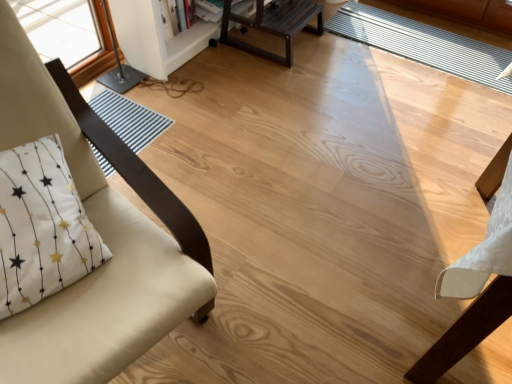
The height and width of the screenshot is (384, 512). I want to click on beige fabric chair at left, so click(104, 240).

Measure the distance between point (195, 288) and camera.

35.75 inches.

Image resolution: width=512 pixels, height=384 pixels. I want to click on white painted wood bookshelf at upper center, so click(156, 37).

Locate an element on the screen. This screenshot has height=384, width=512. white striped mat at center is located at coordinates (423, 44).

Describe the element at coordinates (274, 25) in the screenshot. I see `dark brown wood table at upper center` at that location.

At what (x,y) coordinates should I click in order to perform the action: click on whitetextured fabricpillow at left. Please return your answer as a coordinate pair (x, y). Image resolution: width=512 pixels, height=384 pixels. Looking at the image, I should click on (42, 226).

Find the location of a particular element. The width and height of the screenshot is (512, 384). beige fabric chair at left is located at coordinates (104, 240).

Does whitetextured fabricpillow at left have a greater height compared to dark brown wood table at upper center?

No.

Does whitetextured fabricpillow at left turn towards dark brown wood table at upper center?

No, whitetextured fabricpillow at left is not aimed at dark brown wood table at upper center.

Which is nearer, [35,275] or [294,5]?

Point [35,275] is positioned closer to the camera compared to point [294,5].

Considering the relative sizes of whitetextured fabricpillow at left and dark brown wood table at upper center in the image provided, is whitetextured fabricpillow at left thinner than dark brown wood table at upper center?

Yes.

Between dark brown wood table at upper center and white striped mat at center, which one has less height?

With less height is white striped mat at center.

Which of these two, dark brown wood table at upper center or white striped mat at center, is thinner?

dark brown wood table at upper center is thinner.

Is dark brown wood table at upper center facing away from white striped mat at center?

No.

Is point (300, 27) less distant than point (392, 44)?

Yes, it is in front of point (392, 44).

Which is more to the left, dark brown wood table at upper center or white painted wood bookshelf at upper center?

white painted wood bookshelf at upper center is more to the left.

Looking at this image, is dark brown wood table at upper center bigger than white painted wood bookshelf at upper center?

Incorrect, dark brown wood table at upper center is not larger than white painted wood bookshelf at upper center.

In the scene shown: Can you confirm if dark brown wood table at upper center is shorter than white painted wood bookshelf at upper center?

Yes.

From the image's perspective, does dark brown wood table at upper center appear higher than white painted wood bookshelf at upper center?

Actually, dark brown wood table at upper center appears below white painted wood bookshelf at upper center in the image.

Who is shorter, white striped mat at center or dark brown wood table at upper center?

white striped mat at center is shorter.

You are a GUI agent. You are given a task and a screenshot of the screen. Output one action in this format:
    pyautogui.click(x=<x>, y=<y>)
    Task: Click on the mat below the dark brown wood table at upper center (from the image's perspective)
    Image resolution: width=512 pixels, height=384 pixels.
    Given the screenshot: What is the action you would take?
    pyautogui.click(x=423, y=44)

Is white striped mat at center not close to dark brown wood table at upper center?

white striped mat at center is actually quite close to dark brown wood table at upper center.

From a real-world perspective, is white striped mat at center over dark brown wood table at upper center?

No, from a real-world perspective, white striped mat at center is not over dark brown wood table at upper center

From the image's perspective, is beige fabric chair at left under white striped mat at center?

Yes, from the image's perspective, beige fabric chair at left is below white striped mat at center.

In the image, is beige fabric chair at left positioned in front of or behind white striped mat at center?

beige fabric chair at left is in front of white striped mat at center.

Can you confirm if beige fabric chair at left is positioned to the left of white striped mat at center?

Yes, beige fabric chair at left is to the left of white striped mat at center.

Does point (93, 279) appear closer or farther from the camera than point (499, 57)?

Point (93, 279) is closer to the camera than point (499, 57).

Can you confirm if white painted wood bookshelf at upper center is shorter than white striped mat at center?

In fact, white painted wood bookshelf at upper center may be taller than white striped mat at center.

Considering their positions, is white painted wood bookshelf at upper center located in front of or behind white striped mat at center?

white painted wood bookshelf at upper center is positioned closer to the viewer than white striped mat at center.

Is point (143, 42) positioned in front of point (410, 42)?

Yes, point (143, 42) is closer to viewer.

Looking at their sizes, would you say white painted wood bookshelf at upper center is wider or thinner than white striped mat at center?

white painted wood bookshelf at upper center is thinner than white striped mat at center.

From the image's perspective, which is above, beige fabric chair at left or white painted wood bookshelf at upper center?

white painted wood bookshelf at upper center.

Is point (118, 277) positioned behind point (169, 52)?

That is False.

Considering the sizes of objects beige fabric chair at left and white painted wood bookshelf at upper center in the image provided, who is taller, beige fabric chair at left or white painted wood bookshelf at upper center?

beige fabric chair at left.

Could you tell me if beige fabric chair at left is facing white painted wood bookshelf at upper center?

No, beige fabric chair at left is not facing towards white painted wood bookshelf at upper center.

The height and width of the screenshot is (384, 512). What are the coordinates of `table behind the whitetextured fabricpillow at left` in the screenshot? It's located at (274, 25).

Where is `mat located on the right of dark brown wood table at upper center`? The width and height of the screenshot is (512, 384). mat located on the right of dark brown wood table at upper center is located at coordinates (423, 44).

When comparing their distances from white painted wood bookshelf at upper center, does white striped mat at center or whitetextured fabricpillow at left seem closer?

Among the two, white striped mat at center is located nearer to white painted wood bookshelf at upper center.

When comparing their distances from beige fabric chair at left, does white striped mat at center or dark brown wood table at upper center seem further?

white striped mat at center lies further to beige fabric chair at left than the other object.

From the picture: Looking at the image, which one is located further to whitetextured fabricpillow at left, dark brown wood table at upper center or beige fabric chair at left?

The object further to whitetextured fabricpillow at left is dark brown wood table at upper center.

Based on their spatial positions, is dark brown wood table at upper center or white striped mat at center closer to whitetextured fabricpillow at left?

dark brown wood table at upper center lies closer to whitetextured fabricpillow at left than the other object.

Which object lies nearer to the anchor point dark brown wood table at upper center, white striped mat at center or white painted wood bookshelf at upper center?

The object closer to dark brown wood table at upper center is white painted wood bookshelf at upper center.

Estimate the real-world distances between objects in this image. Which object is further from whitetextured fabricpillow at left, white striped mat at center or white painted wood bookshelf at upper center?

The object further to whitetextured fabricpillow at left is white striped mat at center.

Consider the image. Based on their spatial positions, is beige fabric chair at left or white striped mat at center further from dark brown wood table at upper center?

Among the two, beige fabric chair at left is located further to dark brown wood table at upper center.

Considering their positions, is whitetextured fabricpillow at left positioned further to beige fabric chair at left than white painted wood bookshelf at upper center?

Among the two, white painted wood bookshelf at upper center is located further to beige fabric chair at left.

The height and width of the screenshot is (384, 512). I want to click on table located between white painted wood bookshelf at upper center and white striped mat at center in the left-right direction, so click(274, 25).

You are a GUI agent. You are given a task and a screenshot of the screen. Output one action in this format:
    pyautogui.click(x=<x>, y=<y>)
    Task: Click on the bookshelf between beige fabric chair at left and dark brown wood table at upper center in the front-back direction
    
    Given the screenshot: What is the action you would take?
    pyautogui.click(x=156, y=37)

The width and height of the screenshot is (512, 384). Identify the location of bookshelf between whitetextured fabricpillow at left and dark brown wood table at upper center from front to back. (156, 37).

This screenshot has height=384, width=512. In order to click on pillow positioned between beige fabric chair at left and dark brown wood table at upper center from near to far in this screenshot , I will do `click(42, 226)`.